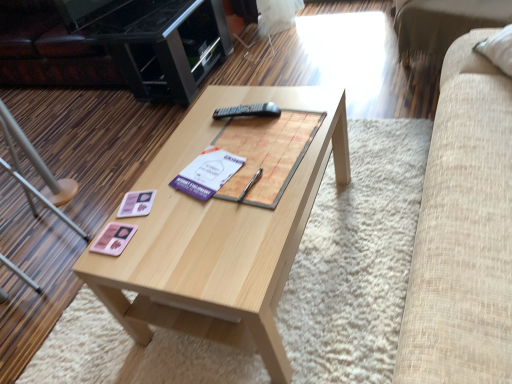
What do you see at coordinates (266, 153) in the screenshot? Image resolution: width=512 pixels, height=384 pixels. I see `wooden magazine at center` at bounding box center [266, 153].

What is the approximate width of black glossy entertainment center at upper left?

The width of black glossy entertainment center at upper left is 52.19 centimeters.

The width and height of the screenshot is (512, 384). What do you see at coordinates (155, 41) in the screenshot?
I see `black glossy entertainment center at upper left` at bounding box center [155, 41].

The image size is (512, 384). Describe the element at coordinates (113, 239) in the screenshot. I see `pink matte card game at center` at that location.

Locate an element on the screen. Image resolution: width=512 pixels, height=384 pixels. pink matte card game at center is located at coordinates (113, 239).

Where is `wooden magazine at center`? The width and height of the screenshot is (512, 384). wooden magazine at center is located at coordinates (266, 153).

From the image's perspective, is metallic silver chair at lower left located above wooden magazine at center?

No, from the image's perspective, metallic silver chair at lower left is not over wooden magazine at center.

Between metallic silver chair at lower left and wooden magazine at center, which one has smaller size?

Smaller between the two is wooden magazine at center.

Is point (10, 151) positioned before point (295, 170)?

No, (10, 151) is further to viewer.

Could you tell me if metallic silver chair at lower left is facing wooden magazine at center?

No, metallic silver chair at lower left does not turn towards wooden magazine at center.

Is pink matte coaster at center-left positioned far away from pink matte card game at center?

pink matte coaster at center-left is near pink matte card game at center, not far away.

From the image's perspective, is pink matte coaster at center-left located above or below pink matte card game at center?

pink matte coaster at center-left is above pink matte card game at center.

Is point (145, 194) closer or farther from the camera than point (97, 250)?

Point (145, 194) appears to be farther away from the viewer than point (97, 250).

Does pink matte coaster at center-left turn towards pink matte card game at center?

No, pink matte coaster at center-left is not aimed at pink matte card game at center.

Is wooden magazine at center surrounding pink matte card game at center?

That's incorrect, pink matte card game at center is not inside wooden magazine at center.

Considering the relative sizes of wooden magazine at center and pink matte card game at center in the image provided, is wooden magazine at center shorter than pink matte card game at center?

No, wooden magazine at center is not shorter than pink matte card game at center.

Is wooden magazine at center with pink matte card game at center?

They are not placed beside each other.

From a real-world perspective, is wooden magazine at center physically located above or below pink matte card game at center?

wooden magazine at center is situated higher than pink matte card game at center in the real world.

Is light wood coffee table at center not near white paper at center?

light wood coffee table at center is actually quite close to white paper at center.

Between light wood coffee table at center and white paper at center, which one appears on the left side from the viewer's perspective?

white paper at center.

Is light wood coffee table at center taller or shorter than white paper at center?

Clearly, light wood coffee table at center is taller compared to white paper at center.

Which object is further away from the camera taking this photo, light wood coffee table at center or white paper at center?

white paper at center is behind.

Would you say black plastic remote at center is outside light wood coffee table at center?

Yes, black plastic remote at center is not within light wood coffee table at center.

Is black plastic remote at center oriented towards light wood coffee table at center?

No, black plastic remote at center is not turned towards light wood coffee table at center.

What's the angular difference between black plastic remote at center and light wood coffee table at center's facing directions?

They differ by 78.7 degrees in their facing directions.

From a real-world perspective, between black plastic remote at center and light wood coffee table at center, who is vertically higher?

From a 3D spatial view, black plastic remote at center is above.

Can you tell me how much wooden magazine at center and black plastic remote at center differ in facing direction?

19 degrees separate the facing orientations of wooden magazine at center and black plastic remote at center.

Is wooden magazine at center inside or outside of black plastic remote at center?

wooden magazine at center exists outside the volume of black plastic remote at center.

From a real-world perspective, is wooden magazine at center physically above black plastic remote at center?

No.

Does wooden magazine at center have a larger size compared to black plastic remote at center?

Correct, wooden magazine at center is larger in size than black plastic remote at center.

Is wooden magazine at center bigger or smaller than black glossy entertainment center at upper left?

Considering their sizes, wooden magazine at center takes up less space than black glossy entertainment center at upper left.

Is wooden magazine at center completely or partially outside of black glossy entertainment center at upper left?

That's correct, wooden magazine at center is outside of black glossy entertainment center at upper left.

What's the angular difference between wooden magazine at center and black glossy entertainment center at upper left's facing directions?

172 degrees.

Which of these two, wooden magazine at center or black glossy entertainment center at upper left, stands shorter?

wooden magazine at center is shorter.

This screenshot has width=512, height=384. I want to click on chair on the left of wooden magazine at center, so click(38, 173).

Where is `card game below the pink matte coaster at center-left (from the image's perspective)`? This screenshot has width=512, height=384. card game below the pink matte coaster at center-left (from the image's perspective) is located at coordinates (113, 239).

Based on their spatial positions, is pink matte card game at center or white paper at center closer to black plastic remote at center?

white paper at center.

Which object lies further to the anchor point pink matte card game at center, light wood coffee table at center or black glossy entertainment center at upper left?

black glossy entertainment center at upper left.

Based on their spatial positions, is wooden magazine at center or beige fabric couch at upper right closer to black plastic remote at center?

Among the two, wooden magazine at center is located nearer to black plastic remote at center.

Which object lies nearer to the anchor point wooden magazine at center, beige fabric couch at upper right or black plastic remote at center?

black plastic remote at center.

When comparing their distances from black plastic remote at center, does black glossy entertainment center at upper left or pink matte coaster at center-left seem closer?

pink matte coaster at center-left.

From the image, which object appears to be farther from pink matte coaster at center-left, metallic silver chair at lower left or white paper at center?

Based on the image, metallic silver chair at lower left appears to be further to pink matte coaster at center-left.

Considering their positions, is black plastic remote at center positioned closer to light wood coffee table at center than wooden magazine at center?

wooden magazine at center lies closer to light wood coffee table at center than the other object.

Considering their positions, is light wood coffee table at center positioned further to pink matte coaster at center-left than pink matte card game at center?

→ light wood coffee table at center.

Find the location of a particular element. The width and height of the screenshot is (512, 384). magazine between pink matte coaster at center-left and beige fabric couch at upper right in the horizontal direction is located at coordinates (266, 153).

Identify the location of card game located between metallic silver chair at lower left and beige fabric couch at upper right in the left-right direction. (113, 239).

Identify the location of paperback book situated between metallic silver chair at lower left and beige fabric couch at upper right from left to right. This screenshot has width=512, height=384. (207, 173).

The image size is (512, 384). In order to click on chair between black glossy entertainment center at upper left and pink matte coaster at center-left vertically in this screenshot , I will do `click(38, 173)`.